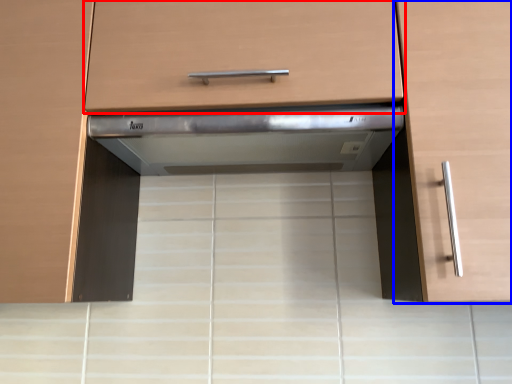
Question: Which object is further to the camera taking this photo, drawer (highlighted by a red box) or cabinetry (highlighted by a blue box)?

Choices:
 (A) drawer
 (B) cabinetry

Answer: (A)